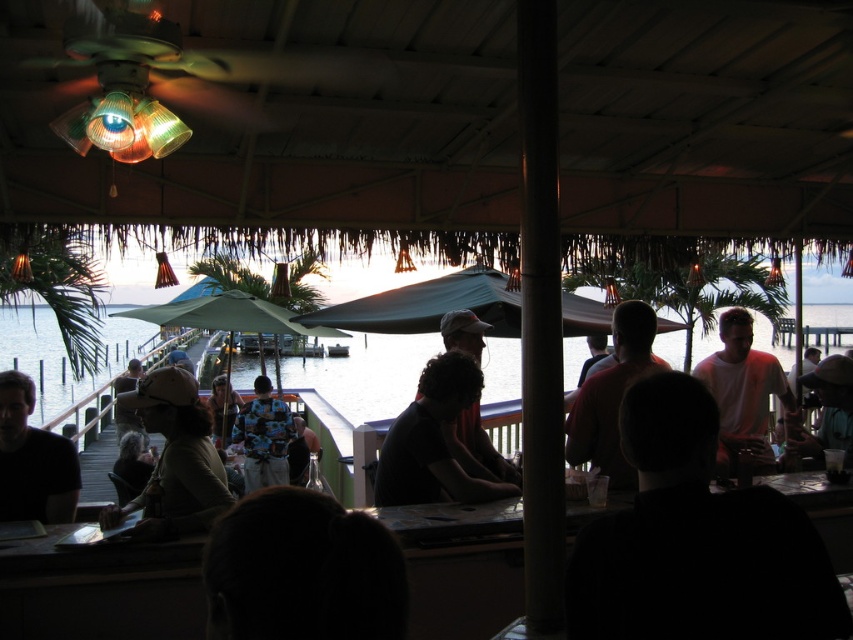
Question: Which of the following is the farthest from the observer?

Choices:
 (A) (848, 387)
 (B) (253, 381)
 (C) (721, 435)

Answer: (B)

Question: Which object is the closest to the clear water at center?

Choices:
 (A) dark blue shirt at right
 (B) dark brown hair at lower center

Answer: (B)

Question: Is the position of white matte shirt at center less distant than that of white matte shirt at right?

Choices:
 (A) no
 (B) yes

Answer: (B)

Question: Among these points, which one is farthest from the camera?

Choices:
 (A) (408, 381)
 (B) (790, 448)

Answer: (A)

Question: Does white matte shirt at center have a larger size compared to blue patterned shirt at center?

Choices:
 (A) no
 (B) yes

Answer: (A)

Question: Is dark blue shirt at left smaller than blue patterned shirt at center?

Choices:
 (A) yes
 (B) no

Answer: (A)